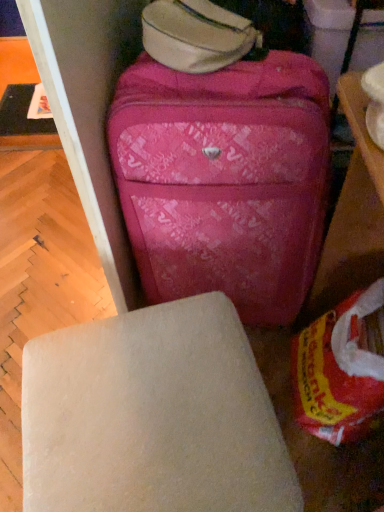
Locate an element on the screen. This screenshot has width=384, height=512. free space above white matte stool at center (from a real-world perspective) is located at coordinates (137, 406).